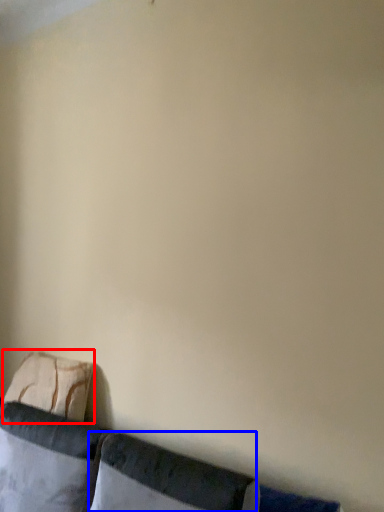
Question: Which object appears closest to the camera in this image, pillow (highlighted by a red box) or pillow (highlighted by a blue box)?

Choices:
 (A) pillow
 (B) pillow

Answer: (B)